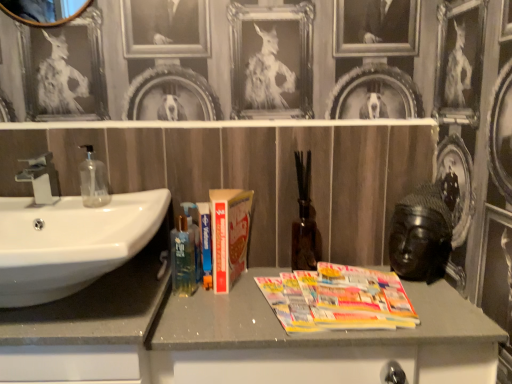
Image resolution: width=512 pixels, height=384 pixels. I want to click on free space on the front side of translucent plastic mouthwash at lower left, so click(204, 314).